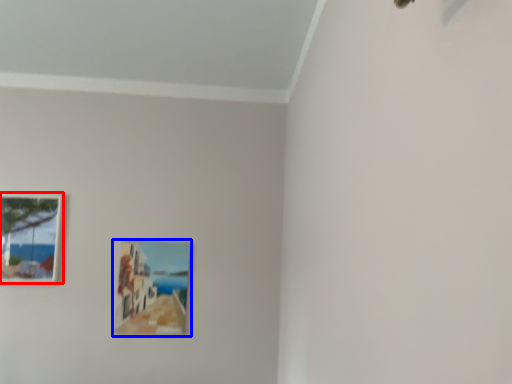
Question: Which point is further to the camera, picture frame (highlighted by a red box) or picture frame (highlighted by a blue box)?

Choices:
 (A) picture frame
 (B) picture frame

Answer: (B)